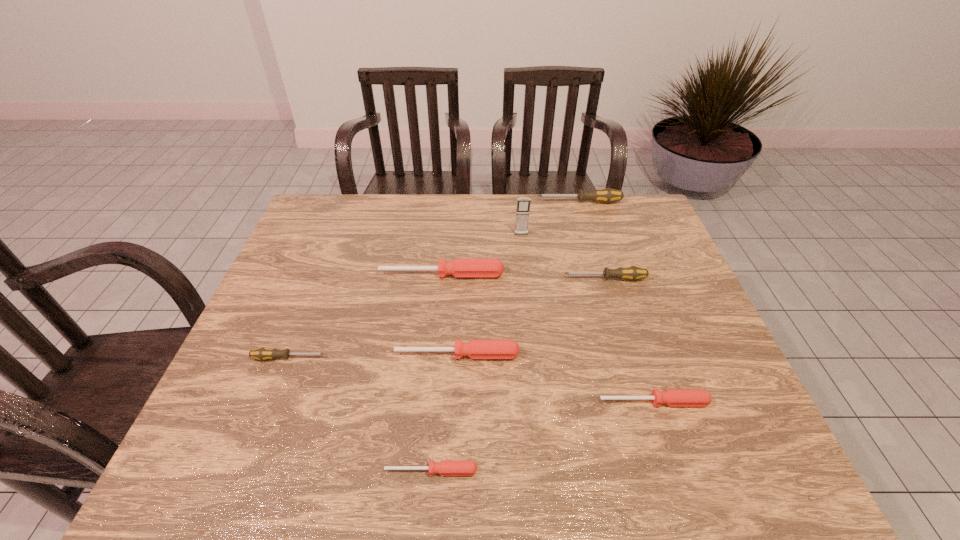
This screenshot has width=960, height=540. Identify the location of the nearest gray screwdriver. (263, 353).

This screenshot has height=540, width=960. Find the location of `the nearest object`. the nearest object is located at coordinates (446, 467).

I want to click on the smallest red screwdriver, so click(446, 467).

Where is `vacant space located 0.120m on the front-facing side of the tallest object`? This screenshot has height=540, width=960. vacant space located 0.120m on the front-facing side of the tallest object is located at coordinates (524, 261).

Find the location of a particular element. This screenshot has height=540, width=960. free region located at the tip of the biggest gray screwdriver is located at coordinates (425, 202).

Image resolution: width=960 pixels, height=540 pixels. In order to click on vacant space located at the tip of the biggest gray screwdriver in this screenshot , I will do `click(477, 202)`.

Locate an element on the screen. The image size is (960, 540). free space located 0.180m at the tip of the biggest gray screwdriver is located at coordinates (486, 202).

I want to click on vacant space situated on the back of the biggest red screwdriver, so click(x=444, y=249).

Where is `vacant area situated 0.100m at the tip of the second farthest gray screwdriver`? This screenshot has height=540, width=960. vacant area situated 0.100m at the tip of the second farthest gray screwdriver is located at coordinates (528, 279).

Identify the location of vacant space located at the tip of the second farthest gray screwdriver. (528, 279).